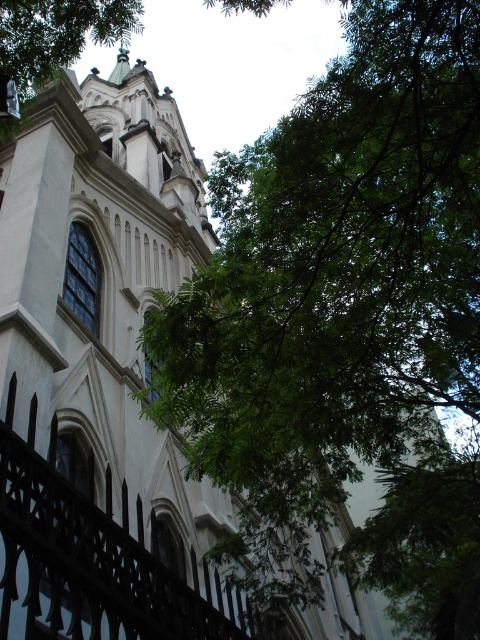
Question: Which point is farther from the camera taking this photo?

Choices:
 (A) (48, 465)
 (B) (430, 632)
 (C) (133, 10)

Answer: (B)

Question: Is black wrought iron fence at lower left closer to the viewer compared to green leafy tree at upper center?

Choices:
 (A) yes
 (B) no

Answer: (A)

Question: Which point is closer to the camera?

Choices:
 (A) (207, 442)
 (B) (133, 605)

Answer: (B)

Question: Does green leafy tree at upper right have a lesser width compared to black wrought iron fence at lower left?

Choices:
 (A) yes
 (B) no

Answer: (B)

Question: From the image, what is the correct spatial relationship of green leafy tree at upper right in relation to black wrought iron fence at lower left?

Choices:
 (A) above
 (B) below

Answer: (A)

Question: Estimate the real-world distances between objects in this image. Which object is farther from the green leafy tree at upper right?

Choices:
 (A) green leafy tree at upper center
 (B) black wrought iron fence at lower left

Answer: (A)